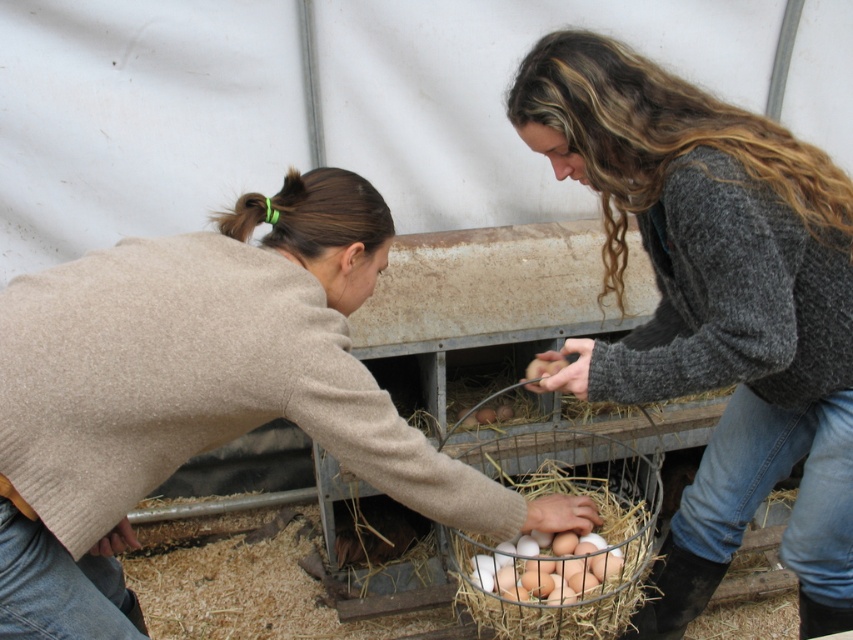
You are standing in the greenhouse and need to access the white straw nest at center. There is a beige wool sweater at lower left in your way. Can you move the sweater to reach the nest?

The beige wool sweater at lower left is in front of the white straw nest at center, so you can move the sweater to access the nest.

You are a delivery robot with a 16 inch wide package. You need to navigate between the beige wool sweater at lower left and the white matte eggs at center to reach the delivery point. Can your package fit through the space between them?

The distance between the beige wool sweater at lower left and the white matte eggs at center is 15.84 inches. Since the package is 16 inches wide, it cannot fit through the space between them as the gap is slightly narrower than the package.